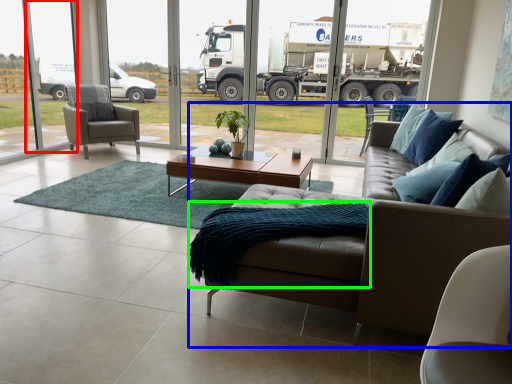
Question: Which is farther away from window screen (highlighted by a red box)? studio couch (highlighted by a blue box) or blanket (highlighted by a green box)?

Choices:
 (A) studio couch
 (B) blanket

Answer: (A)